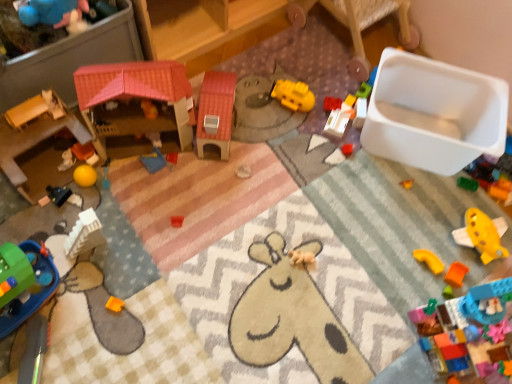
Locate an element on the screen. Image resolution: width=512 pixels, height=384 pixels. vacant space that is in between bright red plastic blocks at center, which ranks as the seventh toy in right-to-left order, and orange matte block at lower right, acting as the 14th toy starting from the left is located at coordinates (395, 200).